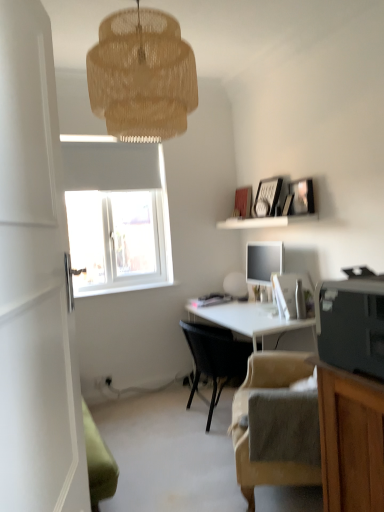
Identify the location of woven beige lampshade at upper center. (142, 76).

Measure the distance between point (377,366) and camera.

A distance of 3.48 feet exists between point (377,366) and camera.

Describe the element at coordinates (351, 325) in the screenshot. I see `black plastic printer at lower right` at that location.

What do you see at coordinates (266, 222) in the screenshot? The height and width of the screenshot is (512, 384). I see `white matte shelf at upper center` at bounding box center [266, 222].

In order to face white glossy door at left, should I rotate leftwards or rightwards?

To face it directly, rotate left by 19.886 degrees.

This screenshot has width=384, height=512. Find the location of `beige fabric chair at lower right, the second chair from the back`. beige fabric chair at lower right, the second chair from the back is located at coordinates (248, 432).

Where is `woven beige lampshade at upper center`? This screenshot has height=512, width=384. woven beige lampshade at upper center is located at coordinates (142, 76).

Can we say white matte shelf at upper center lies outside woven beige lampshade at upper center?

Yes, white matte shelf at upper center is located beyond the bounds of woven beige lampshade at upper center.

Considering the sizes of objects white matte shelf at upper center and woven beige lampshade at upper center in the image provided, who is thinner, white matte shelf at upper center or woven beige lampshade at upper center?

With smaller width is white matte shelf at upper center.

From a real-world perspective, is white matte shelf at upper center on woven beige lampshade at upper center?

Actually, white matte shelf at upper center is physically below woven beige lampshade at upper center in the real world.

Considering the points (30, 504) and (276, 463), which point is behind, point (30, 504) or point (276, 463)?

The point (276, 463) is farther.

Can you tell me how much white glossy door at left and beige fabric chair at lower right, which is the 1th chair in front-to-back order, differ in facing direction?

The angle between the facing direction of white glossy door at left and the facing direction of beige fabric chair at lower right, which is the 1th chair in front-to-back order, is 170 degrees.

The height and width of the screenshot is (512, 384). I want to click on the 2nd chair counting from the right of the white glossy door at left, so click(248, 432).

Consider the image. From a real-world perspective, is white glossy door at left physically located above or below beige fabric chair at lower right, which is the 1th chair in front-to-back order?

white glossy door at left is situated higher than beige fabric chair at lower right, which is the 1th chair in front-to-back order, in the real world.

What's the angular difference between white glossy desk at center and woven beige lampshade at upper center's facing directions?

white glossy desk at center and woven beige lampshade at upper center are facing 89.5 degrees away from each other.

From a real-world perspective, who is located higher, white glossy desk at center or woven beige lampshade at upper center?

From a 3D spatial view, woven beige lampshade at upper center is above.

How much distance is there between white glossy desk at center and woven beige lampshade at upper center?

white glossy desk at center and woven beige lampshade at upper center are 1.70 meters apart from each other.

Is white glossy desk at center not within woven beige lampshade at upper center?

That's correct, white glossy desk at center is outside of woven beige lampshade at upper center.

Which object is thinner, black woven chair at center, the 1th chair in the back-to-front sequence, or black plastic printer at lower right?

Thinner between the two is black plastic printer at lower right.

Based on the photo, how different are the orientations of black woven chair at center, the second chair positioned from the front, and black plastic printer at lower right in degrees?

94.4 degrees separate the facing orientations of black woven chair at center, the second chair positioned from the front, and black plastic printer at lower right.

Is black woven chair at center, the second chair positioned from the front, not within black plastic printer at lower right?

Yes, black woven chair at center, the second chair positioned from the front, is located beyond the bounds of black plastic printer at lower right.

Is black woven chair at center, the second chair positioned from the front, smaller than black plastic printer at lower right?

No.

Considering the relative sizes of black woven chair at center, the 1th chair in the back-to-front sequence, and white glossy desk at center in the image provided, is black woven chair at center, the 1th chair in the back-to-front sequence, smaller than white glossy desk at center?

Indeed, black woven chair at center, the 1th chair in the back-to-front sequence, has a smaller size compared to white glossy desk at center.

Image resolution: width=384 pixels, height=512 pixels. What are the coordinates of `chair behind the white glossy desk at center` in the screenshot? It's located at (215, 358).

Considering the points (200, 326) and (249, 308), which point is behind, point (200, 326) or point (249, 308)?

The point (249, 308) is more distant.

Considering the sizes of objects black woven chair at center, the 1th chair in the back-to-front sequence, and white glossy desk at center in the image provided, who is thinner, black woven chair at center, the 1th chair in the back-to-front sequence, or white glossy desk at center?

black woven chair at center, the 1th chair in the back-to-front sequence, is thinner.

Is the depth of black woven chair at center, the 1th chair in the back-to-front sequence, greater than that of white glossy door at left?

Yes, it is.

From a real-world perspective, is black woven chair at center, the 1th chair in the back-to-front sequence, physically below white glossy door at left?

Yes.

Which is more to the right, black woven chair at center, the second chair positioned from the front, or white glossy door at left?

black woven chair at center, the second chair positioned from the front, is more to the right.

From the image's perspective, which is below, black woven chair at center, the 1th chair in the back-to-front sequence, or white glossy door at left?

black woven chair at center, the 1th chair in the back-to-front sequence, appears lower in the image.

From the image's perspective, does white glossy door at left appear lower than black plastic printer at lower right?

No.

Where is `glass door that appears in front of the black plastic printer at lower right`? This screenshot has width=384, height=512. glass door that appears in front of the black plastic printer at lower right is located at coordinates (x=35, y=281).

In the image, is white glossy door at left positioned in front of or behind black plastic printer at lower right?

white glossy door at left is positioned closer to the viewer than black plastic printer at lower right.

Based on the photo, does white glossy door at left have a lesser width compared to black plastic printer at lower right?

Indeed, white glossy door at left has a lesser width compared to black plastic printer at lower right.

At what (x,y) coordinates should I click in order to perform the action: click on shelf beneath the woven beige lampshade at upper center (from a real-world perspective). Please return your answer as a coordinate pair (x, y). Looking at the image, I should click on (266, 222).

Find the location of a particular element. This screenshot has width=384, height=512. glass door above the beige fabric chair at lower right, the second chair from the back (from the image's perspective) is located at coordinates (35, 281).

Considering their positions, is white matte shelf at upper center positioned further to white glossy door at left than black woven chair at center, the 1th chair in the back-to-front sequence?

Based on the image, white matte shelf at upper center appears to be further to white glossy door at left.

Looking at the image, which one is located closer to white glossy desk at center, white glossy door at left or beige fabric chair at lower right, which is the 1th chair in front-to-back order?

beige fabric chair at lower right, which is the 1th chair in front-to-back order, lies closer to white glossy desk at center than the other object.

When comparing their distances from black plastic printer at lower right, does white matte shelf at upper center or beige fabric chair at lower right, the second chair from the back, seem further?

white matte shelf at upper center is further to black plastic printer at lower right.

Estimate the real-world distances between objects in this image. Which object is closer to beige fabric chair at lower right, which is the 1th chair in front-to-back order, woven beige lampshade at upper center or white glossy desk at center?

white glossy desk at center lies closer to beige fabric chair at lower right, which is the 1th chair in front-to-back order, than the other object.

Which object lies nearer to the anchor point black plastic printer at lower right, white glossy door at left or white glossy desk at center?

Based on the image, white glossy door at left appears to be nearer to black plastic printer at lower right.

Estimate the real-world distances between objects in this image. Which object is closer to beige fabric chair at lower right, which is the 1th chair in front-to-back order, white matte shelf at upper center or white glossy desk at center?

The object closer to beige fabric chair at lower right, which is the 1th chair in front-to-back order, is white glossy desk at center.

Considering their positions, is white glossy desk at center positioned further to beige fabric chair at lower right, the second chair from the back, than white matte shelf at upper center?

white matte shelf at upper center is positioned further to the anchor beige fabric chair at lower right, the second chair from the back.

Looking at the image, which one is located further to black plastic printer at lower right, white matte shelf at upper center or white glossy door at left?

white matte shelf at upper center lies further to black plastic printer at lower right than the other object.

Identify the location of chair between woven beige lampshade at upper center and black woven chair at center, the 1th chair in the back-to-front sequence, in the up-down direction. (248, 432).

Where is `desk between black plastic printer at lower right and black woven chair at center, the 1th chair in the back-to-front sequence, along the z-axis`? This screenshot has width=384, height=512. desk between black plastic printer at lower right and black woven chair at center, the 1th chair in the back-to-front sequence, along the z-axis is located at coordinates pyautogui.click(x=252, y=321).

Identify the location of printer located between white glossy door at left and beige fabric chair at lower right, which is the 1th chair in front-to-back order, in the depth direction. (351, 325).

The image size is (384, 512). I want to click on shelf between woven beige lampshade at upper center and black woven chair at center, the second chair positioned from the front, in the vertical direction, so click(x=266, y=222).